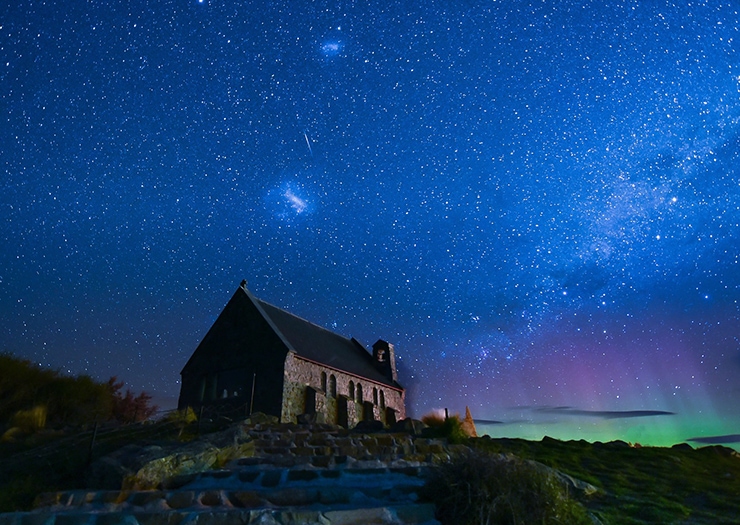
Locate an element on the screen. Image resolution: width=740 pixels, height=525 pixels. walls is located at coordinates (278, 375), (297, 379).